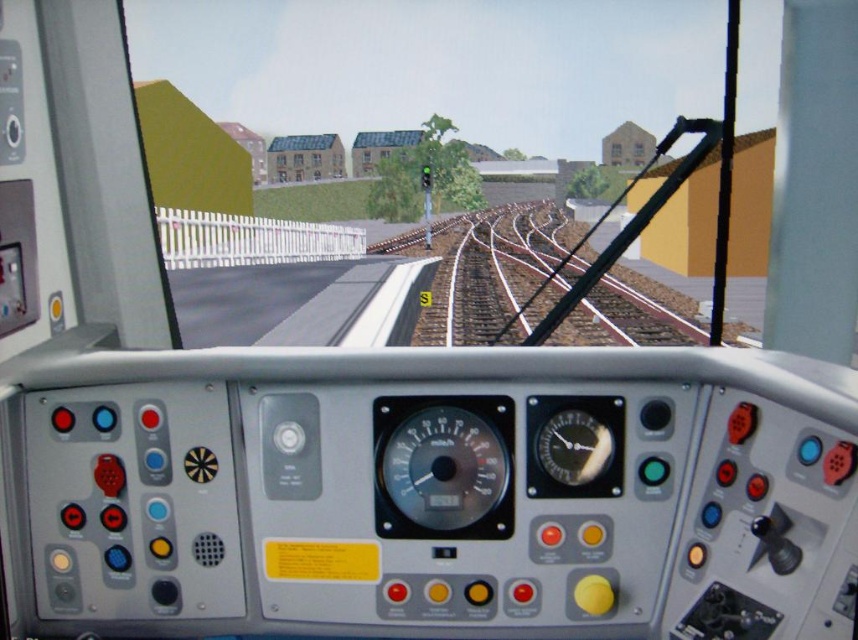
Can you confirm if metallic gauge at center is shorter than shiny metallic gauge at center?

Incorrect, metallic gauge at center's height does not fall short of shiny metallic gauge at center's.

Is metallic gauge at center in front of shiny metallic gauge at center?

No, metallic gauge at center is behind shiny metallic gauge at center.

Who is more distant from viewer, (424,518) or (578,465)?

The point (424,518) is behind.

The image size is (858, 640). I want to click on metallic gauge at center, so click(x=444, y=467).

Can you confirm if brown wooden train track at center is positioned below metallic gauge at center?

No, brown wooden train track at center is not below metallic gauge at center.

Which is in front, point (472, 333) or point (414, 428)?

Point (414, 428) is in front.

Does point (454, 307) come in front of point (433, 428)?

No.

Locate an element on the screen. Image resolution: width=858 pixels, height=640 pixels. brown wooden train track at center is located at coordinates (511, 273).

Who is lower down, brown wooden train track at center or shiny metallic gauge at center?

Positioned lower is shiny metallic gauge at center.

Is point (538, 266) positioned in front of point (605, 442)?

No.

Locate an element on the screen. The width and height of the screenshot is (858, 640). brown wooden train track at center is located at coordinates (511, 273).